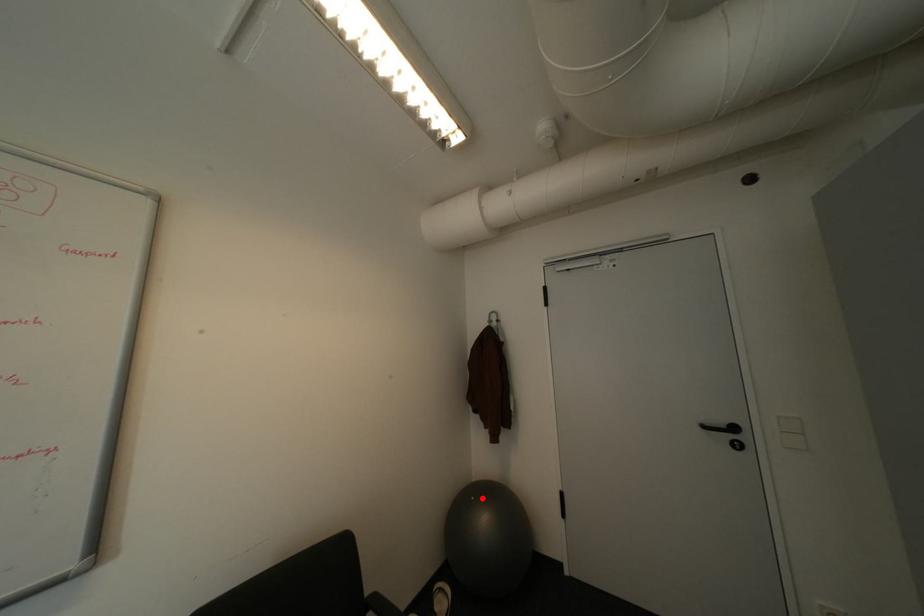
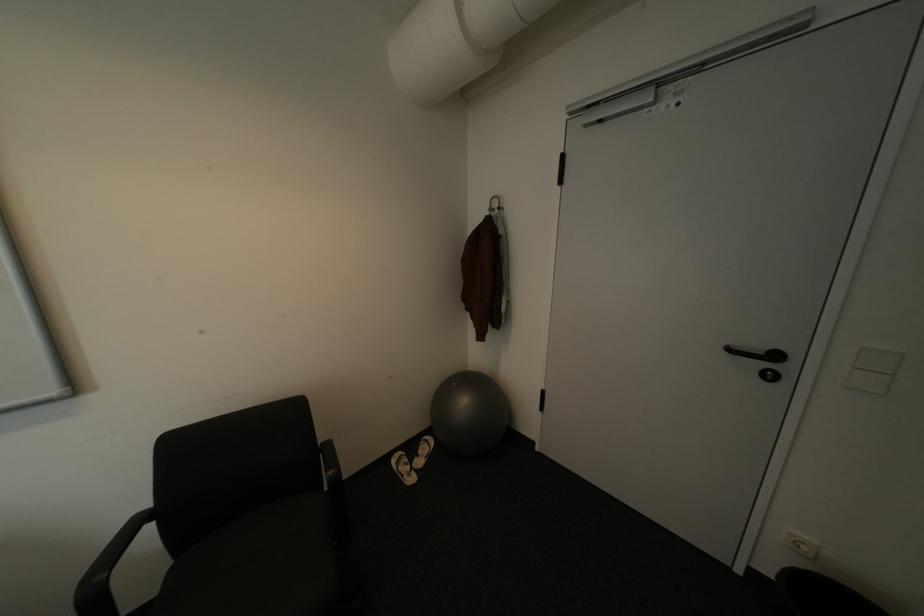
Find the pixel in the second image that matches the highlighted location in the first image.

(464, 384)